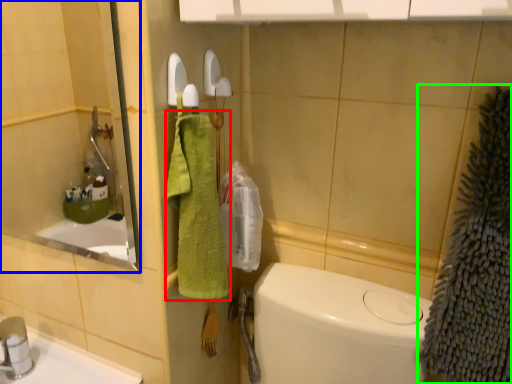
Question: Based on their relative distances, which object is nearer to bath towel (highlighted by a red box)? Choose from mirror (highlighted by a blue box) and bath towel (highlighted by a green box).

Choices:
 (A) mirror
 (B) bath towel

Answer: (B)